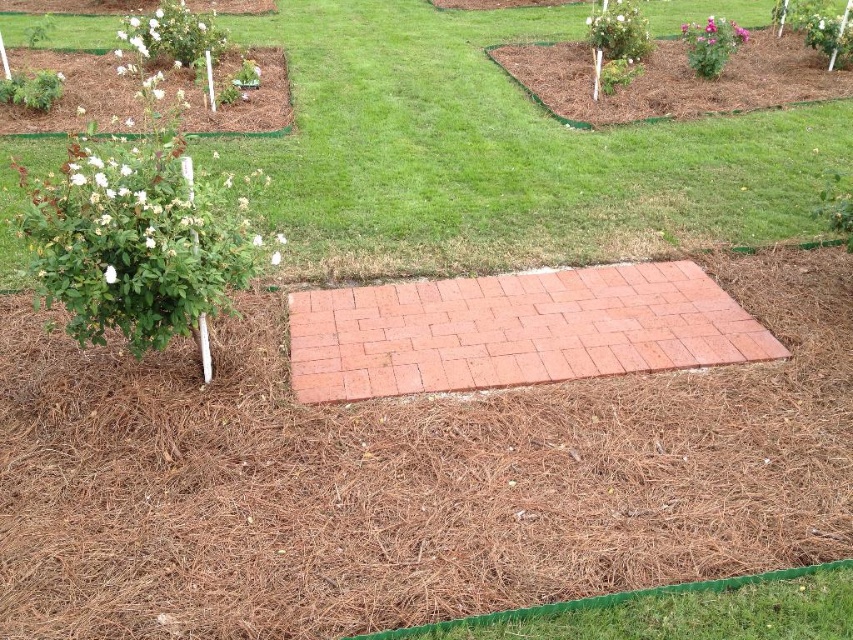
Question: Is red brick path at center positioned behind white matte flower at lower left?

Choices:
 (A) yes
 (B) no

Answer: (B)

Question: Which point is closer to the camera?

Choices:
 (A) white matte flower at left
 (B) red brick path at center
 (C) pink matte flower at upper right
 (D) white matte flower at lower left

Answer: (A)

Question: Which point appears farthest from the camera in this image?

Choices:
 (A) (112, 268)
 (B) (544, 605)
 (C) (535, 348)
 (D) (270, 260)

Answer: (D)

Question: From the image, what is the correct spatial relationship of green grass at lower center in relation to white matte flower at left?

Choices:
 (A) right
 (B) left

Answer: (A)

Question: Which point appears closest to the camera in this image?

Choices:
 (A) (732, 33)
 (B) (273, 260)

Answer: (B)

Question: Can you confirm if pink matte flower at upper right is positioned above white matte flower at lower left?

Choices:
 (A) no
 (B) yes

Answer: (B)